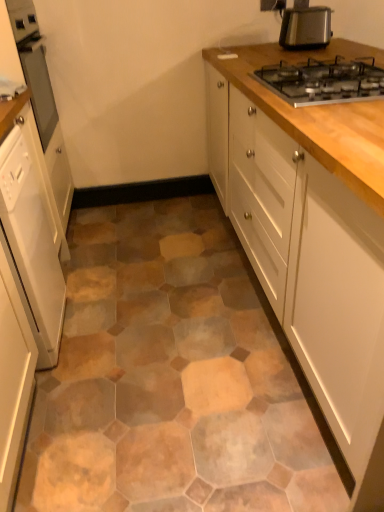
The image size is (384, 512). What are the coordinates of `white wood cabinet at upper right, which ranks as the 3th cabinetry in left-to-right order` in the screenshot? It's located at (319, 115).

Measure the distance between point (x=35, y=12) and camera.

The depth of point (x=35, y=12) is 2.23 meters.

Where is `metallic silver gas stove at upper right`? This screenshot has height=512, width=384. metallic silver gas stove at upper right is located at coordinates (323, 81).

Where is `white wood cabinet at upper right, which ranks as the 3th cabinetry in left-to-right order`? Image resolution: width=384 pixels, height=512 pixels. white wood cabinet at upper right, which ranks as the 3th cabinetry in left-to-right order is located at coordinates (319, 115).

Relative to metallic silver gas stove at upper right, is white glossy dishwasher at left, which is the third cabinetry from right to left, in front or behind?

Visually, white glossy dishwasher at left, which is the third cabinetry from right to left, is located in front of metallic silver gas stove at upper right.

Between white glossy dishwasher at left, which is the third cabinetry from right to left, and metallic silver gas stove at upper right, which one has more height?

Standing taller between the two is white glossy dishwasher at left, which is the third cabinetry from right to left.

From the image's perspective, is white glossy dishwasher at left, marked as the first cabinetry in a left-to-right arrangement, above metallic silver gas stove at upper right?

Actually, white glossy dishwasher at left, marked as the first cabinetry in a left-to-right arrangement, appears below metallic silver gas stove at upper right in the image.

Which cabinetry is the 2nd one when counting from the front of the metallic silver gas stove at upper right? Please provide its 2D coordinates.

[(26, 278)]

Is metallic silver toaster at upper right at the back of white glossy cabinet at left, the second cabinetry positioned from the right?

No.

From a real-world perspective, is white glossy cabinet at left, the second cabinetry positioned from the right, on metallic silver toaster at upper right?

No, from a real-world perspective, white glossy cabinet at left, the second cabinetry positioned from the right, is not on top of metallic silver toaster at upper right.

I want to click on kitchen appliance that appears on the right of white glossy cabinet at left, the second cabinetry positioned from the right, so click(305, 26).

Would you say white glossy cabinet at left, which is counted as the 2th cabinetry, starting from the left, is inside or outside metallic silver toaster at upper right?

white glossy cabinet at left, which is counted as the 2th cabinetry, starting from the left, is not enclosed by metallic silver toaster at upper right.

Is white glossy dishwasher at left, marked as the first cabinetry in a left-to-right arrangement, facing away from white wood cabinet at upper right, which ranks as the 3th cabinetry in left-to-right order?

That's not correct — white glossy dishwasher at left, marked as the first cabinetry in a left-to-right arrangement, is not looking away from white wood cabinet at upper right, which ranks as the 3th cabinetry in left-to-right order.

From the image's perspective, which is below, white glossy dishwasher at left, marked as the first cabinetry in a left-to-right arrangement, or white wood cabinet at upper right, which ranks as the 3th cabinetry in left-to-right order?

white glossy dishwasher at left, marked as the first cabinetry in a left-to-right arrangement, is shown below in the image.

Measure the distance between white glossy dishwasher at left, marked as the first cabinetry in a left-to-right arrangement, and white wood cabinet at upper right, arranged as the 1th cabinetry when viewed from the right.

The distance of white glossy dishwasher at left, marked as the first cabinetry in a left-to-right arrangement, from white wood cabinet at upper right, arranged as the 1th cabinetry when viewed from the right, is 3.40 feet.

Is white wood cabinet at upper right, arranged as the 1th cabinetry when viewed from the right, located within white glossy dishwasher at left, marked as the first cabinetry in a left-to-right arrangement?

No, white wood cabinet at upper right, arranged as the 1th cabinetry when viewed from the right, is not surrounded by white glossy dishwasher at left, marked as the first cabinetry in a left-to-right arrangement.

From the image's perspective, would you say metallic silver toaster at upper right is positioned over white glossy cabinet at left, the second cabinetry positioned from the right?

Yes.

Does point (298, 18) come farther from viewer compared to point (61, 272)?

That is False.

Which object is positioned more to the left, metallic silver toaster at upper right or white glossy cabinet at left, the second cabinetry positioned from the right?

white glossy cabinet at left, the second cabinetry positioned from the right.

Considering the sizes of metallic silver toaster at upper right and white glossy cabinet at left, which is counted as the 2th cabinetry, starting from the left, in the image, is metallic silver toaster at upper right wider or thinner than white glossy cabinet at left, which is counted as the 2th cabinetry, starting from the left,?

In the image, metallic silver toaster at upper right appears to be more narrow than white glossy cabinet at left, which is counted as the 2th cabinetry, starting from the left.

Locate an element on the screen. This screenshot has width=384, height=512. the 2nd cabinetry in front of the matte glass oven at left is located at coordinates (26, 278).

Considering the relative sizes of white glossy dishwasher at left, which is the third cabinetry from right to left, and matte glass oven at left in the image provided, is white glossy dishwasher at left, which is the third cabinetry from right to left, bigger than matte glass oven at left?

Yes, white glossy dishwasher at left, which is the third cabinetry from right to left, is bigger than matte glass oven at left.

Which object is more forward, white glossy dishwasher at left, which is the third cabinetry from right to left, or matte glass oven at left?

white glossy dishwasher at left, which is the third cabinetry from right to left, is closer to the camera.

The image size is (384, 512). What are the coordinates of `gas stove lying below the metallic silver toaster at upper right (from the image's perspective)` in the screenshot? It's located at (323, 81).

From a real-world perspective, is metallic silver gas stove at upper right under metallic silver toaster at upper right?

Indeed, from a real-world perspective, metallic silver gas stove at upper right is positioned beneath metallic silver toaster at upper right.

Consider the image. Can you confirm if metallic silver gas stove at upper right is positioned to the left of metallic silver toaster at upper right?

Correct, you'll find metallic silver gas stove at upper right to the left of metallic silver toaster at upper right.

Is point (30, 242) behind point (10, 347)?

Yes, it is.

In the scene shown: Is white glossy cabinet at left, the second cabinetry positioned from the right, oriented towards white glossy dishwasher at left, which is the third cabinetry from right to left?

Yes.

From a real-world perspective, which object stands above the other?

From a 3D spatial view, white glossy dishwasher at left, marked as the first cabinetry in a left-to-right arrangement, is above.

What's the angular difference between white glossy cabinet at left, the second cabinetry positioned from the right, and white glossy dishwasher at left, which is the third cabinetry from right to left,'s facing directions?

0.00193 degrees.

From a real-world perspective, which cabinetry is the 2nd one underneath the metallic silver gas stove at upper right? Please provide its 2D coordinates.

[(26, 278)]

Where is `kitchen appliance that appears above the white glossy cabinet at left, the second cabinetry positioned from the right (from a real-world perspective)`? kitchen appliance that appears above the white glossy cabinet at left, the second cabinetry positioned from the right (from a real-world perspective) is located at coordinates (305, 26).

Considering their positions, is metallic silver gas stove at upper right positioned further to white glossy dishwasher at left, marked as the first cabinetry in a left-to-right arrangement, than white wood cabinet at upper right, which ranks as the 3th cabinetry in left-to-right order?

The object further to white glossy dishwasher at left, marked as the first cabinetry in a left-to-right arrangement, is metallic silver gas stove at upper right.

Which object lies further to the anchor point metallic silver gas stove at upper right, white glossy cabinet at left, the second cabinetry positioned from the right, or metallic silver toaster at upper right?

white glossy cabinet at left, the second cabinetry positioned from the right, is positioned further to the anchor metallic silver gas stove at upper right.

Considering their positions, is matte glass oven at left positioned further to white glossy dishwasher at left, marked as the first cabinetry in a left-to-right arrangement, than metallic silver toaster at upper right?

metallic silver toaster at upper right is positioned further to the anchor white glossy dishwasher at left, marked as the first cabinetry in a left-to-right arrangement.

From the image, which object appears to be farther from white wood cabinet at upper right, which ranks as the 3th cabinetry in left-to-right order, matte glass oven at left or white glossy cabinet at left, the second cabinetry positioned from the right?

Based on the image, matte glass oven at left appears to be further to white wood cabinet at upper right, which ranks as the 3th cabinetry in left-to-right order.

Considering their positions, is metallic silver toaster at upper right positioned closer to white wood cabinet at upper right, which ranks as the 3th cabinetry in left-to-right order, than matte glass oven at left?

Based on the image, metallic silver toaster at upper right appears to be nearer to white wood cabinet at upper right, which ranks as the 3th cabinetry in left-to-right order.

When comparing their distances from metallic silver gas stove at upper right, does matte glass oven at left or white wood cabinet at upper right, arranged as the 1th cabinetry when viewed from the right, seem further?

matte glass oven at left.

When comparing their distances from metallic silver gas stove at upper right, does white glossy dishwasher at left, marked as the first cabinetry in a left-to-right arrangement, or white wood cabinet at upper right, arranged as the 1th cabinetry when viewed from the right, seem closer?

white wood cabinet at upper right, arranged as the 1th cabinetry when viewed from the right, lies closer to metallic silver gas stove at upper right than the other object.

Considering their positions, is metallic silver gas stove at upper right positioned further to white wood cabinet at upper right, which ranks as the 3th cabinetry in left-to-right order, than matte glass oven at left?

Among the two, matte glass oven at left is located further to white wood cabinet at upper right, which ranks as the 3th cabinetry in left-to-right order.

Where is `gas stove positioned between white wood cabinet at upper right, arranged as the 1th cabinetry when viewed from the right, and metallic silver toaster at upper right from near to far`? gas stove positioned between white wood cabinet at upper right, arranged as the 1th cabinetry when viewed from the right, and metallic silver toaster at upper right from near to far is located at coordinates (323, 81).

I want to click on gas stove between white glossy cabinet at left, the second cabinetry positioned from the right, and metallic silver toaster at upper right from left to right, so click(323, 81).

At what (x,y) coordinates should I click in order to perform the action: click on cabinetry located between white glossy dishwasher at left, which is the third cabinetry from right to left, and metallic silver gas stove at upper right in the left-right direction. Please return your answer as a coordinate pair (x, y). This screenshot has height=512, width=384. Looking at the image, I should click on (32, 240).

Identify the location of kitchen appliance between matte glass oven at left and white wood cabinet at upper right, arranged as the 1th cabinetry when viewed from the right, from left to right. (305, 26).